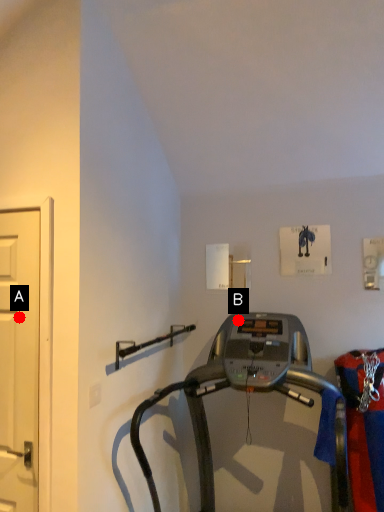
Question: Two points are circled on the image, labeled by A and B beside each circle. Which point is farther from the camera taking this photo?

Choices:
 (A) A is further
 (B) B is further

Answer: (B)